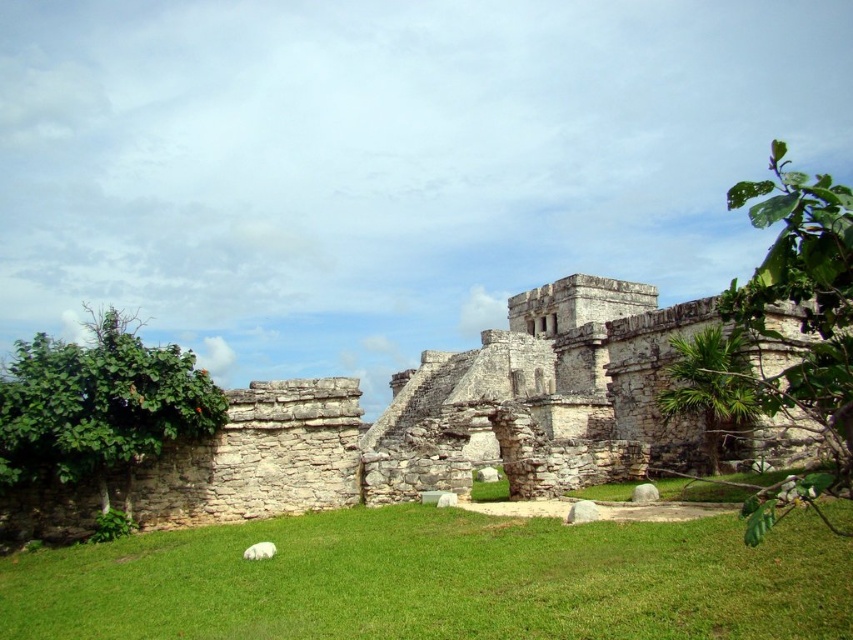
You are standing on the grassy path near the stone ruins at center and want to take a photo of the white fluffy dog at lower left. Which object should be closer to the camera to ensure the dog is in focus?

The white fluffy dog at lower left is closer to the viewer than the stone ruins at center, so to focus on the dog, the camera should be closer to the dog.

From the picture: You are a photographer planning to take a picture of the ancient stone structure. You want to include both the green grass at center and the white fluffy dog at lower left in your shot. Which object should you focus on first to ensure both are in frame?

The green grass at center is bigger than the white fluffy dog at lower left, so you should focus on the white fluffy dog at lower left first to ensure both fit within the frame.